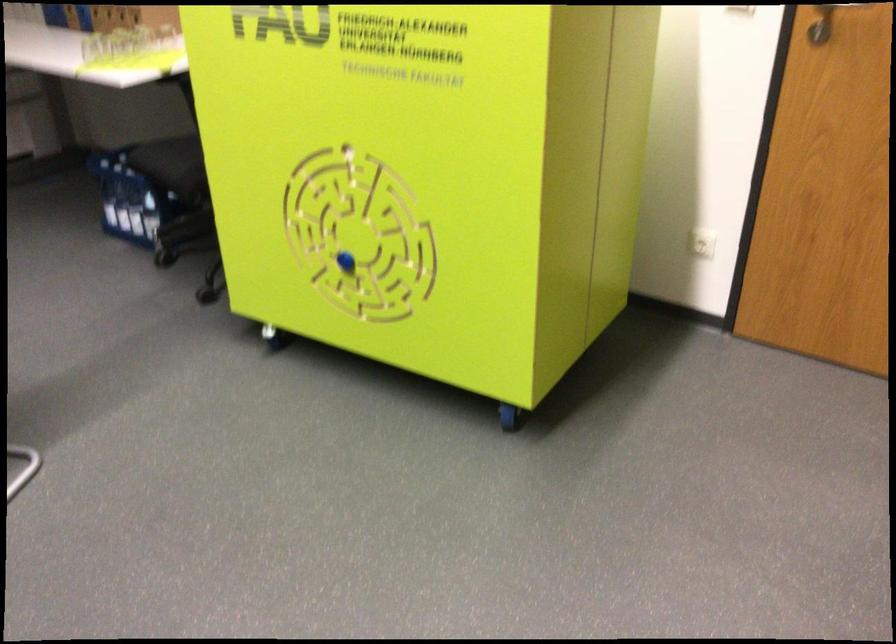
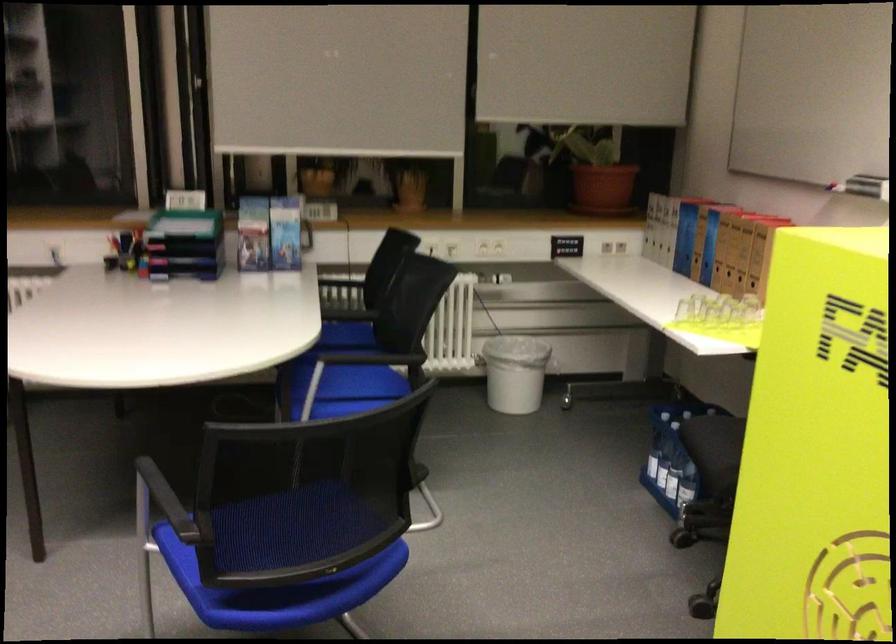
Locate, in the second image, the point that corresponds to the point at 133,213 in the first image.

(667, 471)